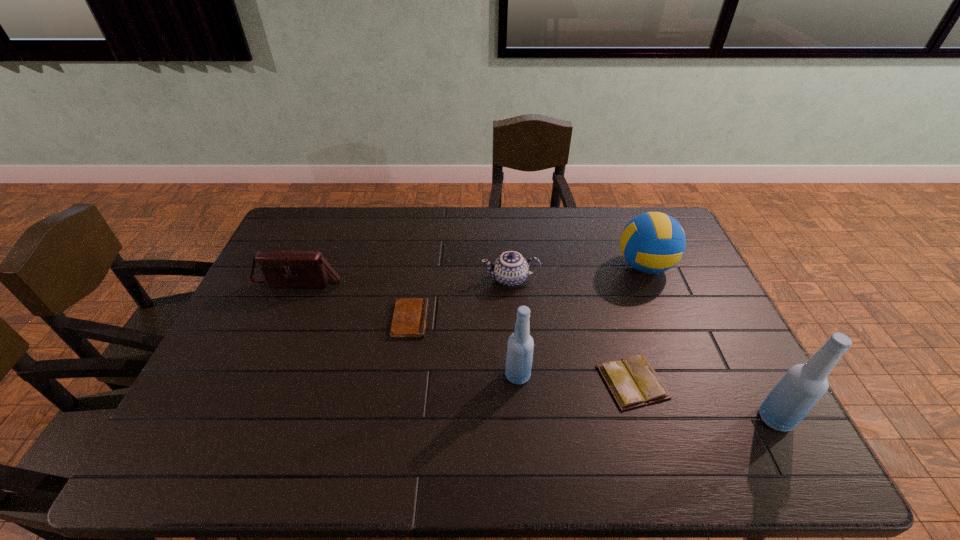
Please point a free position for a bottle on the left. Please provide its 2D coordinates. Your answer should be formatted as a tuple, i.e. [(x, y)], where the tuple contains the x and y coordinates of a point satisfying the conditions above.

[(297, 339)]